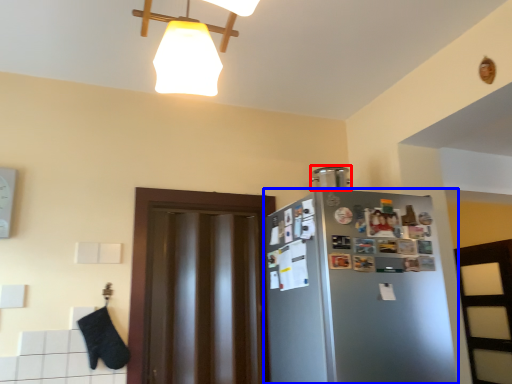
Question: Which object appears closest to the camera in this image, appliance (highlighted by a red box) or refrigerator (highlighted by a blue box)?

Choices:
 (A) appliance
 (B) refrigerator

Answer: (B)